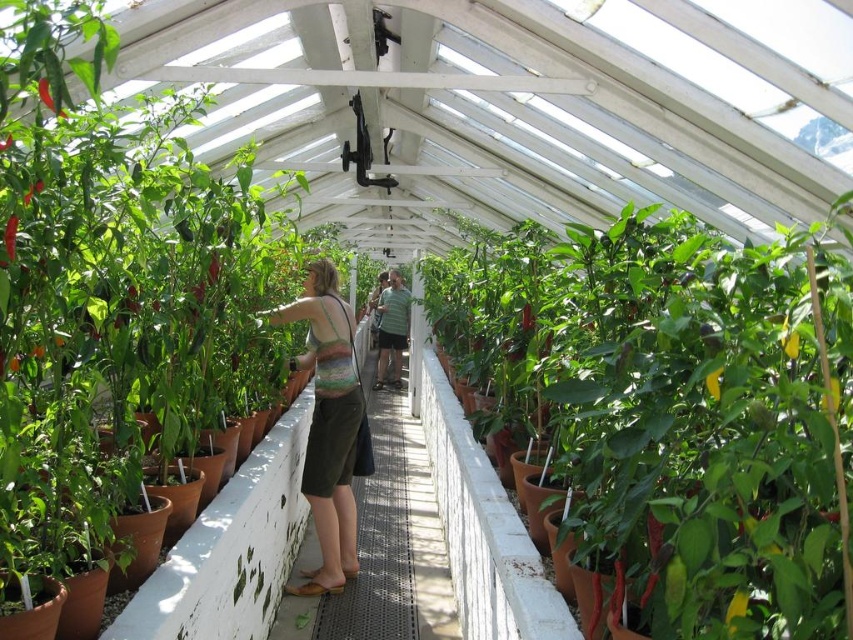
Question: Based on their relative distances, which object is nearer to the multicolored knitted tank top at center?

Choices:
 (A) green matte pot at center
 (B) green striped shirt at center

Answer: (A)

Question: Which point is closer to the camera?

Choices:
 (A) multicolored knitted tank top at center
 (B) green striped shirt at center
 (C) green matte pot at center

Answer: (C)

Question: Does green matte pot at center appear under multicolored knitted tank top at center?

Choices:
 (A) yes
 (B) no

Answer: (B)

Question: Which of the following is the closest to the observer?

Choices:
 (A) click(x=339, y=378)
 (B) click(x=740, y=496)
 (C) click(x=397, y=298)

Answer: (B)

Question: Does green matte pot at center have a larger size compared to green striped shirt at center?

Choices:
 (A) no
 (B) yes

Answer: (B)

Question: Can you confirm if green matte pot at center is smaller than multicolored knitted tank top at center?

Choices:
 (A) no
 (B) yes

Answer: (A)